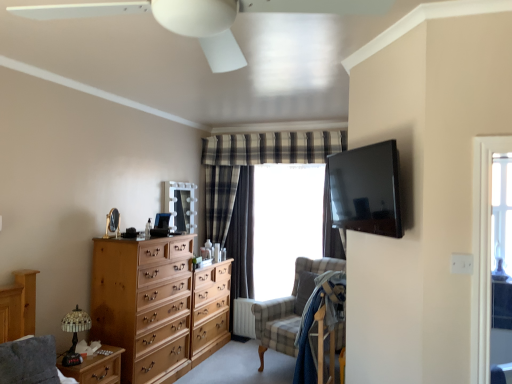
What do you see at coordinates (366, 189) in the screenshot? The height and width of the screenshot is (384, 512). I see `matte black tv at upper right` at bounding box center [366, 189].

This screenshot has height=384, width=512. What do you see at coordinates (200, 19) in the screenshot?
I see `white plastic ceiling fan at upper center` at bounding box center [200, 19].

Describe the element at coordinates (244, 318) in the screenshot. This screenshot has height=384, width=512. I see `white textured radiator at lower center` at that location.

I want to click on checkered fabric swivel chair at center, so click(x=288, y=308).

Find the location of a particular element. The image size is (512, 384). television above the checkered fabric swivel chair at center (from a real-world perspective) is located at coordinates (366, 189).

From their relative heights in the image, would you say checkered fabric swivel chair at center is taller or shorter than matte black tv at upper right?

In the image, checkered fabric swivel chair at center appears to be taller than matte black tv at upper right.

From a real-world perspective, which is physically below, checkered fabric swivel chair at center or matte black tv at upper right?

In real-world perspective, checkered fabric swivel chair at center is lower.

Between wooden nightstand at lower left and light brown wooden chest of drawers at left, which one appears on the left side from the viewer's perspective?

Positioned to the left is wooden nightstand at lower left.

Is wooden nightstand at lower left looking in the opposite direction of light brown wooden chest of drawers at left?

wooden nightstand at lower left does not have its back to light brown wooden chest of drawers at left.

Is wooden nightstand at lower left shorter than light brown wooden chest of drawers at left?

Yes.

Is wooden nightstand at lower left next to light brown wooden chest of drawers at left?

wooden nightstand at lower left and light brown wooden chest of drawers at left are not in contact.

Which is in front, point (139, 307) or point (288, 300)?

The point (139, 307) is closer.

Is the surface of light brown wooden chest of drawers at left in direct contact with checkered fabric swivel chair at center?

There is a gap between light brown wooden chest of drawers at left and checkered fabric swivel chair at center.

From the image's perspective, is light brown wooden chest of drawers at left on top of checkered fabric swivel chair at center?

Correct, light brown wooden chest of drawers at left appears higher than checkered fabric swivel chair at center in the image.

Considering the points (100, 276) and (303, 190), which point is behind, point (100, 276) or point (303, 190)?

Point (303, 190)

Are light brown wooden chest of drawers at left and transparent glass window at center far apart?

Absolutely, light brown wooden chest of drawers at left is distant from transparent glass window at center.

Does light brown wooden chest of drawers at left have a larger size compared to transparent glass window at center?

Yes, light brown wooden chest of drawers at left is bigger than transparent glass window at center.

Identify the location of window screen located above the light brown wooden chest of drawers at left (from the image's perspective). (285, 224).

Which point is more distant from viewer, (281, 206) or (331, 3)?

The point (281, 206) is farther.

Do you think transparent glass window at center is within white plastic ceiling fan at upper center, or outside of it?

transparent glass window at center cannot be found inside white plastic ceiling fan at upper center.

From their relative heights in the image, would you say transparent glass window at center is taller or shorter than white plastic ceiling fan at upper center?

In the image, transparent glass window at center appears to be taller than white plastic ceiling fan at upper center.

Is transparent glass window at center turned away from white plastic ceiling fan at upper center?

That's not correct — transparent glass window at center is not looking away from white plastic ceiling fan at upper center.

Is matte black tv at upper right placed right next to checkered fabric swivel chair at center?

No, matte black tv at upper right is not touching checkered fabric swivel chair at center.

Which object is wider, matte black tv at upper right or checkered fabric swivel chair at center?

checkered fabric swivel chair at center.

Between matte black tv at upper right and checkered fabric swivel chair at center, which one is positioned behind?

checkered fabric swivel chair at center.

Visually, is matte black tv at upper right positioned to the left or to the right of checkered fabric swivel chair at center?

matte black tv at upper right is to the right of checkered fabric swivel chair at center.

From the image's perspective, relative to white plastic ceiling fan at upper center, is wooden nightstand at lower left above or below?

wooden nightstand at lower left is below white plastic ceiling fan at upper center.

Looking at this image, which is more distant, (120,364) or (365,6)?

The point (120,364) is more distant.

Can you confirm if wooden nightstand at lower left is shorter than white plastic ceiling fan at upper center?

Correct, wooden nightstand at lower left is not as tall as white plastic ceiling fan at upper center.

Is wooden nightstand at lower left beside white plastic ceiling fan at upper center?

There is a gap between wooden nightstand at lower left and white plastic ceiling fan at upper center.

Identify the location of television on the right of checkered fabric swivel chair at center. (366, 189).

Where is `chest of drawers above the wooden nightstand at lower left (from a real-world perspective)`? This screenshot has height=384, width=512. chest of drawers above the wooden nightstand at lower left (from a real-world perspective) is located at coordinates (149, 307).

Estimate the real-world distances between objects in this image. Which object is further from transparent glass window at center, wooden nightstand at lower left or white plastic ceiling fan at upper center?

The object further to transparent glass window at center is white plastic ceiling fan at upper center.

Which object lies nearer to the anchor point checkered fabric swivel chair at center, light brown wooden chest of drawers at left or wooden nightstand at lower left?

Based on the image, light brown wooden chest of drawers at left appears to be nearer to checkered fabric swivel chair at center.

From the picture: Which object lies nearer to the anchor point matte black tv at upper right, white textured radiator at lower center or light brown wooden chest of drawers at left?

light brown wooden chest of drawers at left is closer to matte black tv at upper right.

Based on the photo, which object lies further to the anchor point white plastic ceiling fan at upper center, transparent glass window at center or checkered fabric swivel chair at center?

transparent glass window at center is positioned further to the anchor white plastic ceiling fan at upper center.

Which object lies nearer to the anchor point transparent glass window at center, white textured radiator at lower center or wooden nightstand at lower left?

white textured radiator at lower center is positioned closer to the anchor transparent glass window at center.

When comparing their distances from transparent glass window at center, does white textured radiator at lower center or light brown wooden chest of drawers at left seem closer?

The object closer to transparent glass window at center is white textured radiator at lower center.

Considering their positions, is matte black tv at upper right positioned further to white plastic ceiling fan at upper center than white textured radiator at lower center?

Based on the image, white textured radiator at lower center appears to be further to white plastic ceiling fan at upper center.

From the image, which object appears to be nearer to white plastic ceiling fan at upper center, matte black tv at upper right or wooden nightstand at lower left?

→ matte black tv at upper right.

You are a GUI agent. You are given a task and a screenshot of the screen. Output one action in this format:
    pyautogui.click(x=<x>, y=<y>)
    Task: Click on the window screen between matte black tv at upper right and white textured radiator at lower center from front to back
    This screenshot has height=384, width=512.
    Given the screenshot: What is the action you would take?
    pyautogui.click(x=285, y=224)

This screenshot has width=512, height=384. I want to click on the chest of drawers located between wooden nightstand at lower left and white textured radiator at lower center in the depth direction, so click(149, 307).

Where is `chest of drawers between white plastic ceiling fan at upper center and checkered fabric swivel chair at center from front to back`? The height and width of the screenshot is (384, 512). chest of drawers between white plastic ceiling fan at upper center and checkered fabric swivel chair at center from front to back is located at coordinates (149, 307).

Find the location of a particular element. The image size is (512, 384). chest of drawers between wooden nightstand at lower left and matte black tv at upper right from left to right is located at coordinates (149, 307).